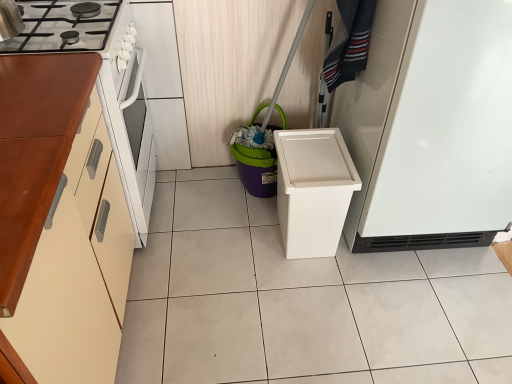
Question: From the image's perspective, does white matte refrigerator at right appear higher than purple plastic bucket at center?

Choices:
 (A) no
 (B) yes

Answer: (B)

Question: Is white matte refrigerator at right bigger than purple plastic bucket at center?

Choices:
 (A) yes
 (B) no

Answer: (A)

Question: From a real-world perspective, is white matte refrigerator at right on top of purple plastic bucket at center?

Choices:
 (A) yes
 (B) no

Answer: (A)

Question: Does white matte refrigerator at right come behind purple plastic bucket at center?

Choices:
 (A) yes
 (B) no

Answer: (B)

Question: Considering the relative sizes of white matte refrigerator at right and purple plastic bucket at center in the image provided, is white matte refrigerator at right thinner than purple plastic bucket at center?

Choices:
 (A) no
 (B) yes

Answer: (A)

Question: From a real-world perspective, relative to denim fabric laundry at upper right, is white matte refrigerator at right vertically above or below?

Choices:
 (A) above
 (B) below

Answer: (B)

Question: Does point (435, 66) appear closer or farther from the camera than point (367, 13)?

Choices:
 (A) closer
 (B) farther

Answer: (A)

Question: From their relative heights in the image, would you say white matte refrigerator at right is taller or shorter than denim fabric laundry at upper right?

Choices:
 (A) short
 (B) tall

Answer: (B)

Question: Considering the positions of white matte refrigerator at right and denim fabric laundry at upper right in the image, is white matte refrigerator at right wider or thinner than denim fabric laundry at upper right?

Choices:
 (A) wide
 (B) thin

Answer: (A)

Question: From the image's perspective, is purple plastic bucket at center positioned above or below denim fabric laundry at upper right?

Choices:
 (A) below
 (B) above

Answer: (A)

Question: Is purple plastic bucket at center to the left or to the right of denim fabric laundry at upper right in the image?

Choices:
 (A) right
 (B) left

Answer: (B)

Question: In the image, is purple plastic bucket at center positioned in front of or behind denim fabric laundry at upper right?

Choices:
 (A) behind
 (B) front

Answer: (A)

Question: Considering the positions of purple plastic bucket at center and denim fabric laundry at upper right in the image, is purple plastic bucket at center bigger or smaller than denim fabric laundry at upper right?

Choices:
 (A) big
 (B) small

Answer: (A)

Question: Is wooden cabinet at left wider or thinner than purple plastic bucket at center?

Choices:
 (A) wide
 (B) thin

Answer: (A)

Question: Does point (72, 317) appear closer or farther from the camera than point (254, 180)?

Choices:
 (A) farther
 (B) closer

Answer: (B)